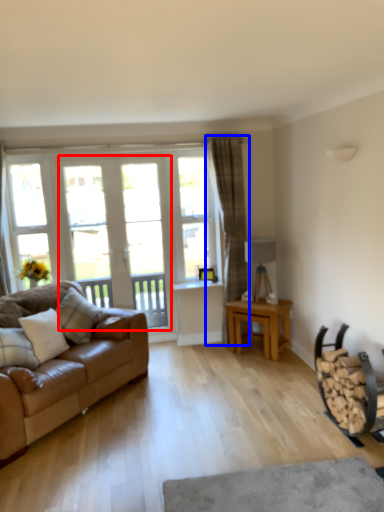
Question: Which of the following is the farthest to the observer, screen door (highlighted by a red box) or curtain (highlighted by a blue box)?

Choices:
 (A) screen door
 (B) curtain

Answer: (A)